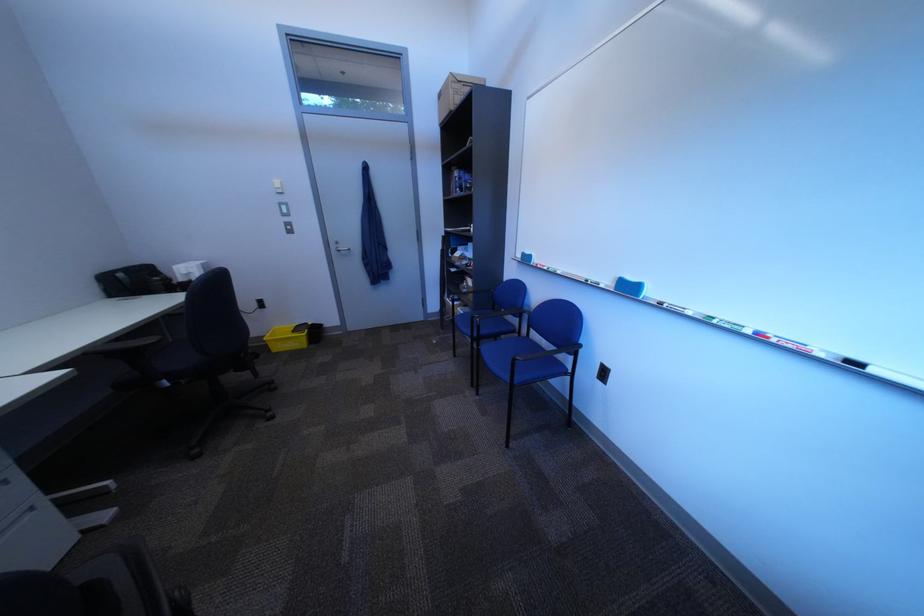
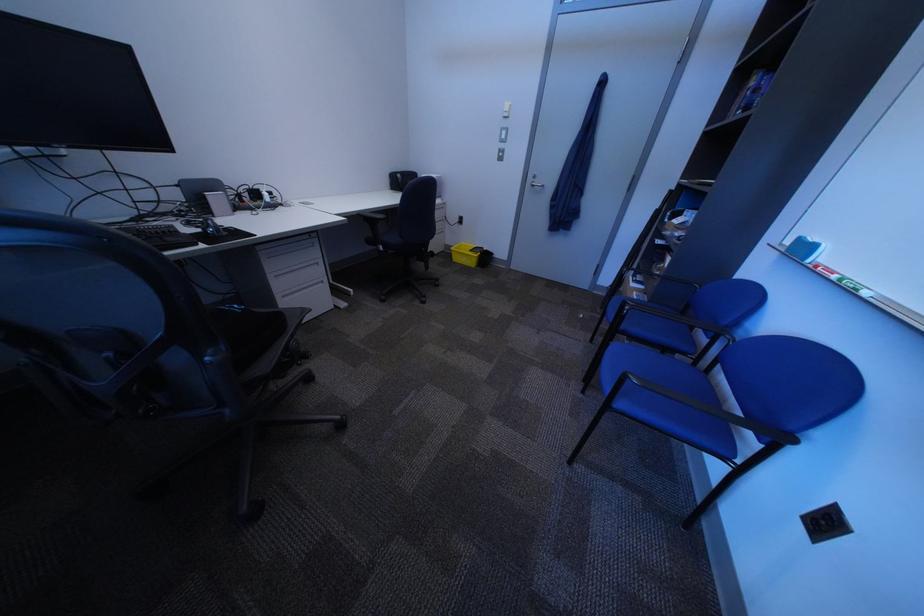
Locate, in the second image, the point that corresponds to the point at 452,344 in the first image.

(599, 318)